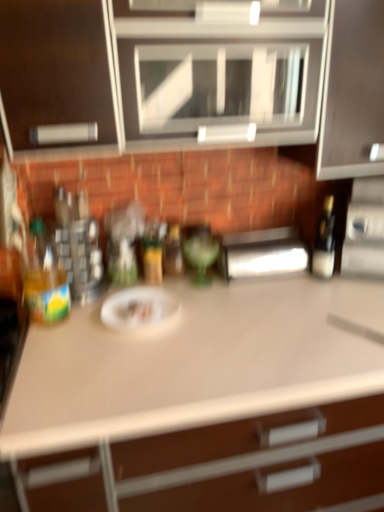
Where is `free point above white matte countertop at center (from a real-world perspective)`? free point above white matte countertop at center (from a real-world perspective) is located at coordinates (235, 312).